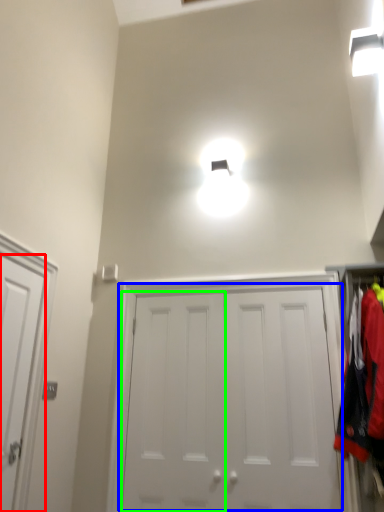
Question: Considering the real-world distances, which object is farthest from door (highlighted by a red box)? door (highlighted by a blue box) or door (highlighted by a green box)?

Choices:
 (A) door
 (B) door

Answer: (A)